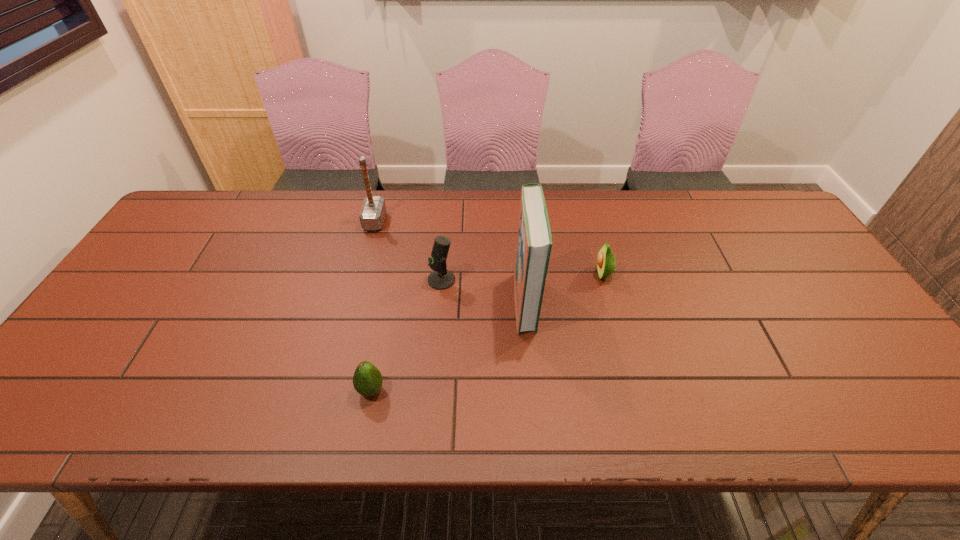
This screenshot has width=960, height=540. Find the location of `vacant space located 0.230m on the cover of the hardback book`. vacant space located 0.230m on the cover of the hardback book is located at coordinates (427, 302).

Find the location of a particular element. The height and width of the screenshot is (540, 960). blank area located 0.350m on the cover of the hardback book is located at coordinates (382, 302).

The height and width of the screenshot is (540, 960). What are the coordinates of `free space located on the cover of the hardback book` in the screenshot? It's located at (431, 302).

Where is `vacant region located 0.330m on the striking surface of the leftmost object`? Image resolution: width=960 pixels, height=540 pixels. vacant region located 0.330m on the striking surface of the leftmost object is located at coordinates (489, 221).

In order to click on free region located 0.320m on the left of the microphone in this screenshot , I will do `click(312, 280)`.

You are a GUI agent. You are given a task and a screenshot of the screen. Output one action in this format:
    pyautogui.click(x=<x>, y=<y>)
    Task: Click on the blank space located on the cut side of the taller avocado
    Image resolution: width=960 pixels, height=540 pixels.
    Given the screenshot: What is the action you would take?
    pyautogui.click(x=484, y=274)

At what (x,y) coordinates should I click in order to perform the action: click on vacant area situated on the cut side of the taller avocado. Please return your answer as a coordinate pair (x, y). Looking at the image, I should click on (459, 274).

Find the location of a particular element. The height and width of the screenshot is (540, 960). vacant space situated 0.330m on the cut side of the taller avocado is located at coordinates (476, 274).

This screenshot has height=540, width=960. I want to click on vacant space located on the left of the fourth object from right to left, so click(218, 390).

Identify the location of object located at the far edge. The width and height of the screenshot is (960, 540). (373, 211).